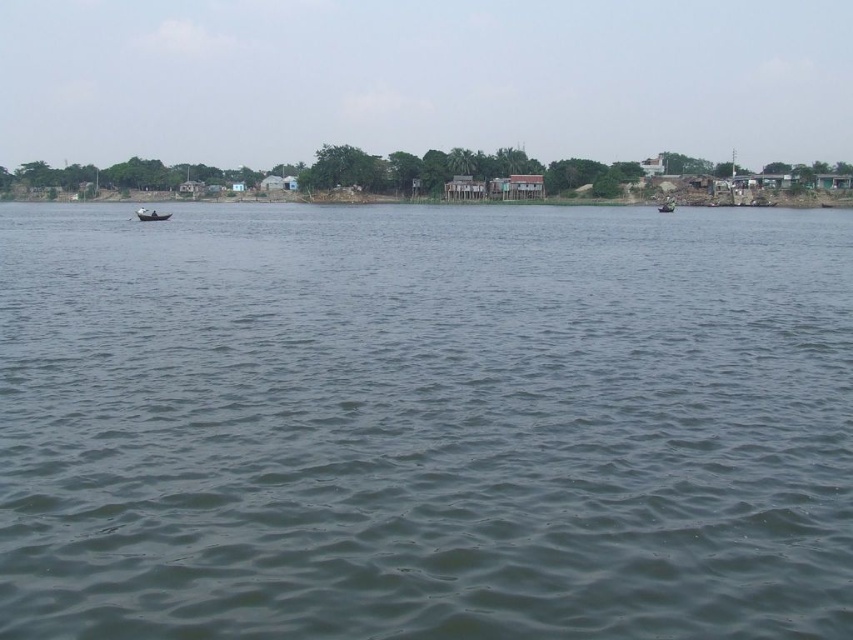
Question: Does greenish water at center come in front of wooden boat at left?

Choices:
 (A) yes
 (B) no

Answer: (A)

Question: Among these points, which one is nearest to the camera?

Choices:
 (A) (x=380, y=524)
 (B) (x=137, y=209)

Answer: (A)

Question: Which object is positioned farthest from the green plastic boat at right?

Choices:
 (A) wooden boat at left
 (B) greenish water at center

Answer: (B)

Question: Considering the relative positions of wooden boat at left and green plastic boat at right in the image provided, where is wooden boat at left located with respect to green plastic boat at right?

Choices:
 (A) right
 (B) left

Answer: (B)

Question: Is greenish water at center smaller than green plastic boat at right?

Choices:
 (A) yes
 (B) no

Answer: (B)

Question: Which point is closer to the camera?

Choices:
 (A) (666, 202)
 (B) (56, 604)
 (C) (136, 211)

Answer: (B)